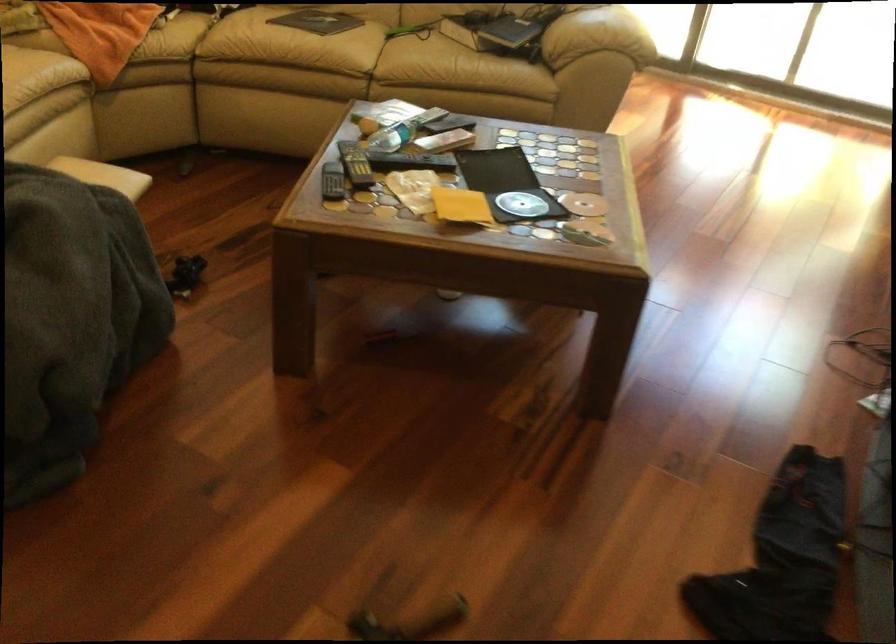
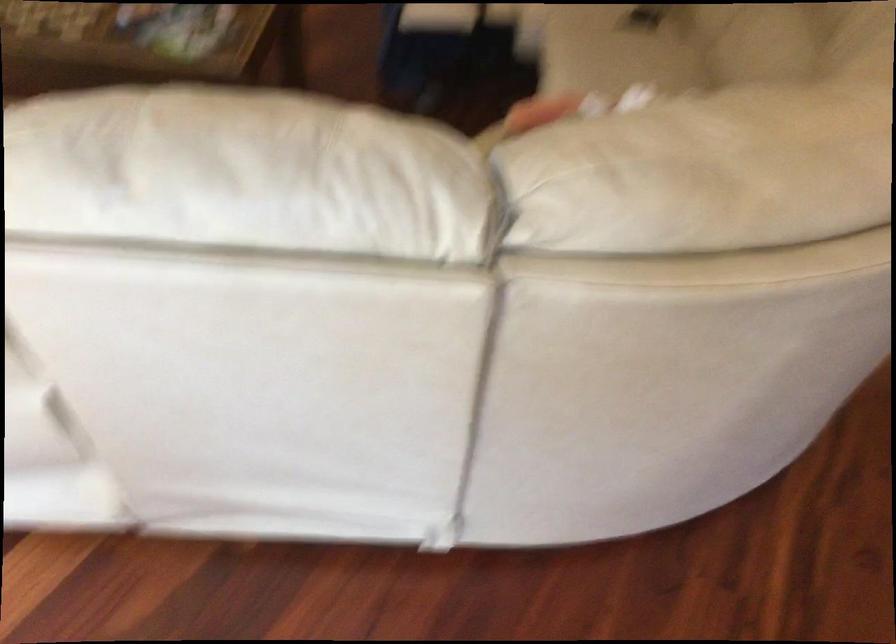
The point at (110,172) is marked in the first image. Where is the corresponding point in the second image?

(437, 17)